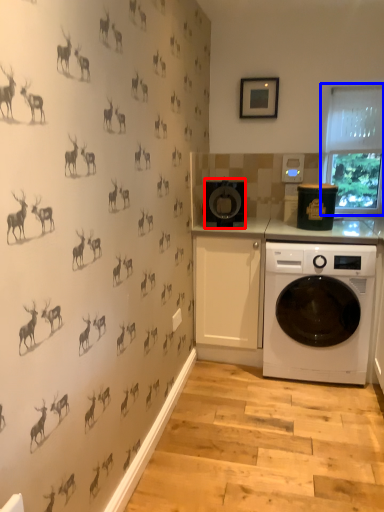
Question: Which object is further to the camera taking this photo, appliance (highlighted by a red box) or window screen (highlighted by a blue box)?

Choices:
 (A) appliance
 (B) window screen

Answer: (B)